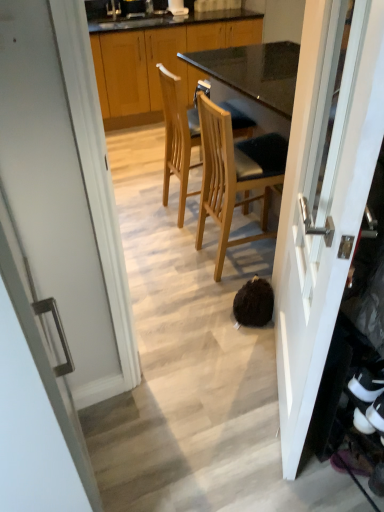
Question: Can you confirm if wooden cabinets at center is smaller than white glossy door at center, which ranks as the 1th door in right-to-left order?

Choices:
 (A) no
 (B) yes

Answer: (A)

Question: Does wooden cabinets at center have a larger size compared to white glossy door at center, which ranks as the 1th door in right-to-left order?

Choices:
 (A) yes
 (B) no

Answer: (A)

Question: Can we say wooden cabinets at center lies outside white glossy door at center, which ranks as the 1th door in right-to-left order?

Choices:
 (A) no
 (B) yes

Answer: (B)

Question: From the image's perspective, is wooden cabinets at center beneath white glossy door at center, which ranks as the 1th door in right-to-left order?

Choices:
 (A) no
 (B) yes

Answer: (A)

Question: Is wooden cabinets at center looking in the opposite direction of white glossy door at center, which ranks as the 1th door in right-to-left order?

Choices:
 (A) yes
 (B) no

Answer: (B)

Question: Is wooden cabinets at center behind white glossy door at center, which ranks as the 1th door in right-to-left order?

Choices:
 (A) yes
 (B) no

Answer: (A)

Question: Does white glossy door at center, which is counted as the 2th door, starting from the left, appear on the right side of wooden cabinets at center?

Choices:
 (A) yes
 (B) no

Answer: (A)

Question: Is white glossy door at center, which ranks as the 1th door in right-to-left order, positioned far away from wooden cabinets at center?

Choices:
 (A) yes
 (B) no

Answer: (A)

Question: From the image's perspective, does white glossy door at center, which is counted as the 2th door, starting from the left, appear higher than wooden cabinets at center?

Choices:
 (A) yes
 (B) no

Answer: (B)

Question: Is white glossy door at center, which ranks as the 1th door in right-to-left order, taller than wooden cabinets at center?

Choices:
 (A) yes
 (B) no

Answer: (A)

Question: Can you confirm if white glossy door at center, which ranks as the 1th door in right-to-left order, is shorter than wooden cabinets at center?

Choices:
 (A) yes
 (B) no

Answer: (B)

Question: Is white glossy door at center, which ranks as the 1th door in right-to-left order, thinner than wooden cabinets at center?

Choices:
 (A) no
 (B) yes

Answer: (B)

Question: Is wooden cabinets at center positioned with its back to white glossy door at center, the first door when ordered from left to right?

Choices:
 (A) yes
 (B) no

Answer: (B)